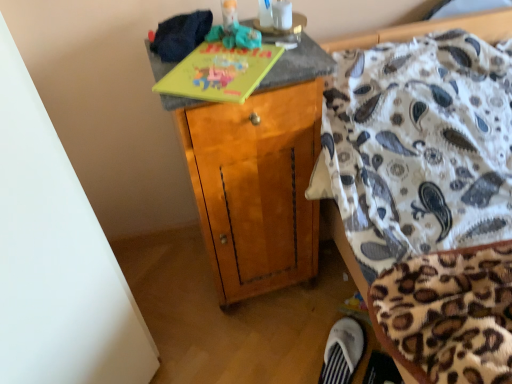
Where is `empty space that is ontop of wooden cabinet at center (from a real-world perspective)`? The height and width of the screenshot is (384, 512). empty space that is ontop of wooden cabinet at center (from a real-world perspective) is located at coordinates (226, 32).